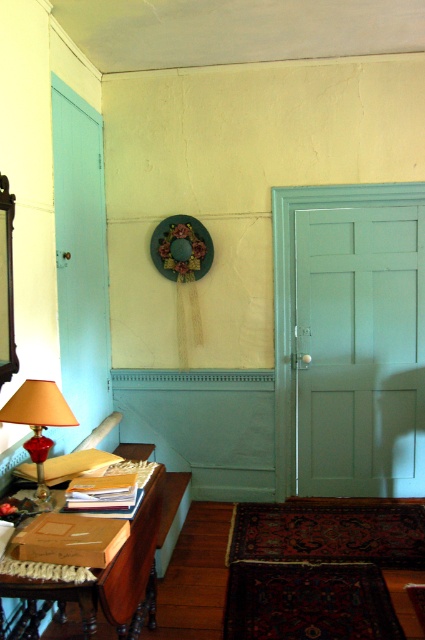
From the picture: Between matte white door at right and matte red glass lamp at left, which one has less height?

Standing shorter between the two is matte red glass lamp at left.

The width and height of the screenshot is (425, 640). What do you see at coordinates (359, 349) in the screenshot? I see `matte white door at right` at bounding box center [359, 349].

The height and width of the screenshot is (640, 425). In order to click on matte white door at right in this screenshot , I will do `click(359, 349)`.

Find the location of a particular element. matte white door at right is located at coordinates [359, 349].

Between wooden table at lower left and green fabric wreath at upper center, which one has more height?

With more height is wooden table at lower left.

Can you confirm if wooden table at lower left is wider than green fabric wreath at upper center?

No.

Which is in front, point (68, 600) or point (192, 253)?

Point (68, 600)

This screenshot has width=425, height=640. Find the location of `wooden table at lower left`. wooden table at lower left is located at coordinates (116, 572).

Based on the photo, does matte red glass lamp at left appear on the left side of green fabric wreath at upper center?

Correct, you'll find matte red glass lamp at left to the left of green fabric wreath at upper center.

Is point (65, 412) positioned before point (161, 256)?

Yes, it is.

Where is `matte red glass lamp at left`? matte red glass lamp at left is located at coordinates (37, 422).